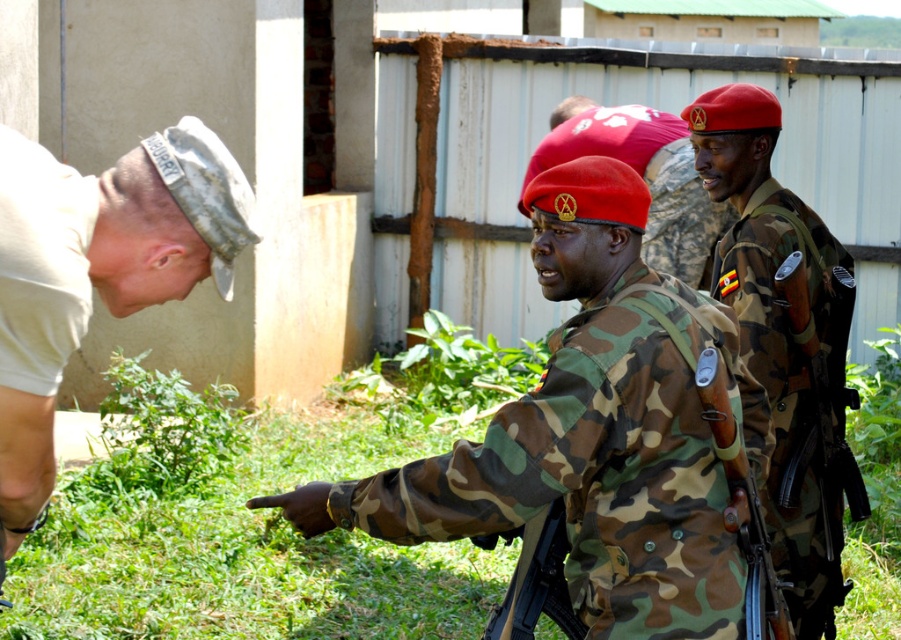
You are a photographer trying to capture a clear shot of the camouflage fabric uniform at center and the white matte cap at lower left. Which object should you focus on first if you want to ensure both are in focus without adjusting the camera settings?

The camouflage fabric uniform at center is shorter than the white matte cap at lower left. To keep both in focus, you should focus on the white matte cap at lower left first since it is farther away, ensuring the depth of field captures the closer camouflage fabric uniform at center as well.